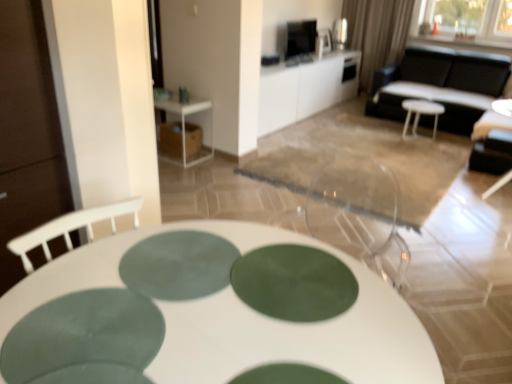
Find the location of a particular element. The width and height of the screenshot is (512, 384). vacant space in front of green matte placemat at center is located at coordinates tap(158, 338).